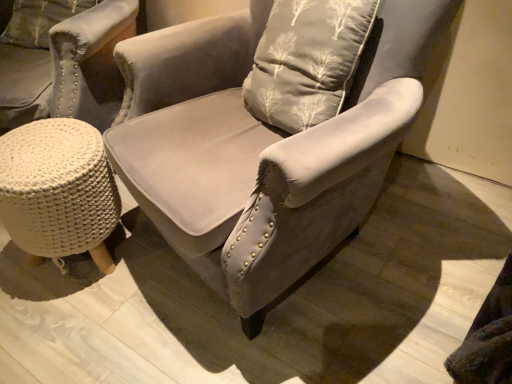
Where is `free space above white knitted stool at lower left (from a real-world perspective)`? Image resolution: width=512 pixels, height=384 pixels. free space above white knitted stool at lower left (from a real-world perspective) is located at coordinates (36, 148).